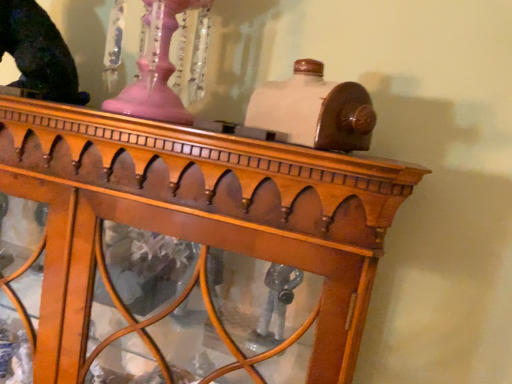
Question: From the image's perspective, relative to wooden table at center, is shiny black statue at upper left above or below?

Choices:
 (A) above
 (B) below

Answer: (A)

Question: In terms of width, does shiny black statue at upper left look wider or thinner when compared to wooden table at center?

Choices:
 (A) thin
 (B) wide

Answer: (A)

Question: Would you say shiny black statue at upper left is inside or outside wooden table at center?

Choices:
 (A) outside
 (B) inside

Answer: (A)

Question: Is point coord(375,236) positioned closer to the camera than point coord(52,69)?

Choices:
 (A) closer
 (B) farther

Answer: (A)

Question: Looking at their shapes, would you say wooden table at center is wider or thinner than shiny black statue at upper left?

Choices:
 (A) thin
 (B) wide

Answer: (B)

Question: From a real-world perspective, is wooden table at center above or below shiny black statue at upper left?

Choices:
 (A) below
 (B) above

Answer: (A)

Question: Considering the positions of wooden table at center and shiny black statue at upper left in the image, is wooden table at center taller or shorter than shiny black statue at upper left?

Choices:
 (A) short
 (B) tall

Answer: (B)